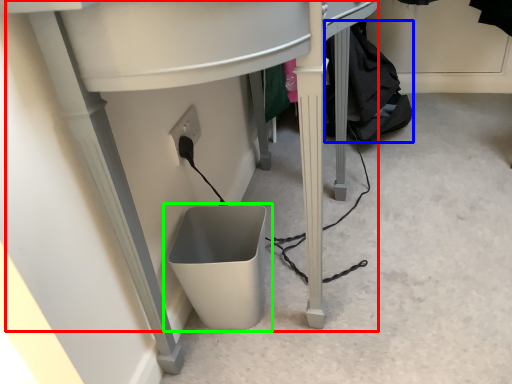
Question: Considering the real-world distances, which object is closest to computer desk (highlighted by a red box)? clothing (highlighted by a blue box) or waste container (highlighted by a green box).

Choices:
 (A) clothing
 (B) waste container

Answer: (B)